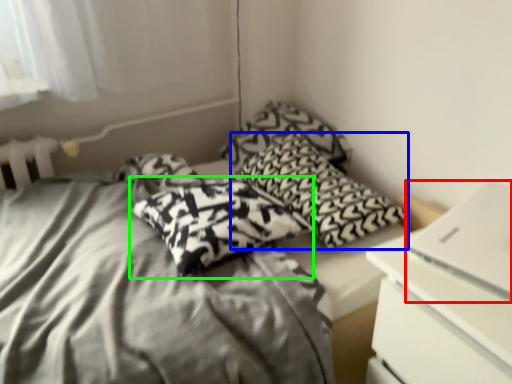
Question: Which object is the closest to the computer (highlighted by a red box)? Choose among these: pillow (highlighted by a blue box) or pillow (highlighted by a green box).

Choices:
 (A) pillow
 (B) pillow

Answer: (A)